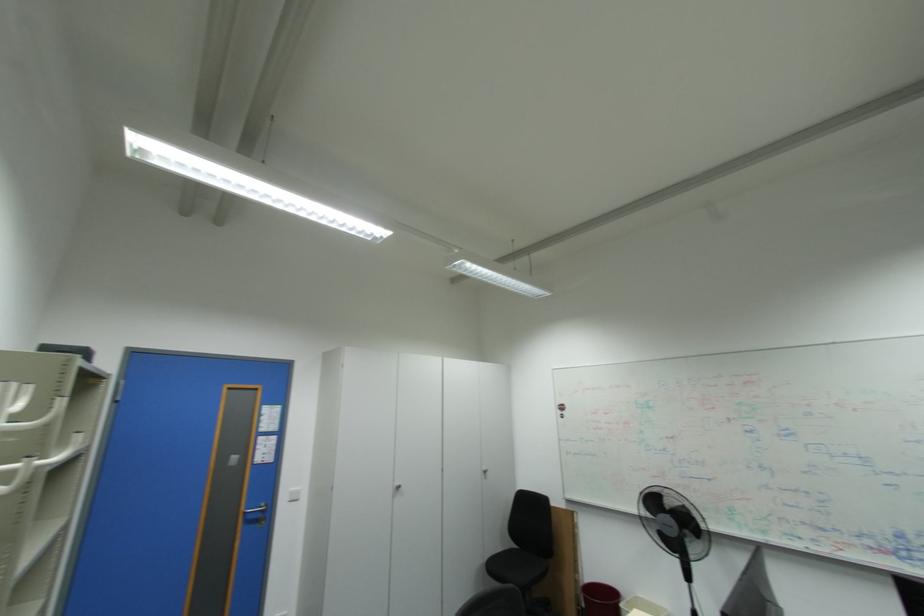
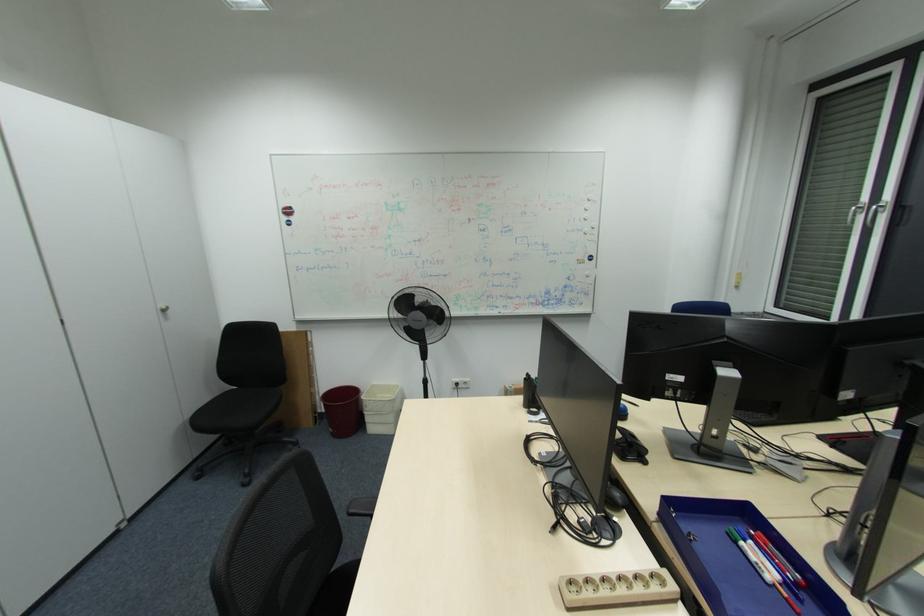
How did the camera likely rotate?

The camera's rotation is toward right-down.